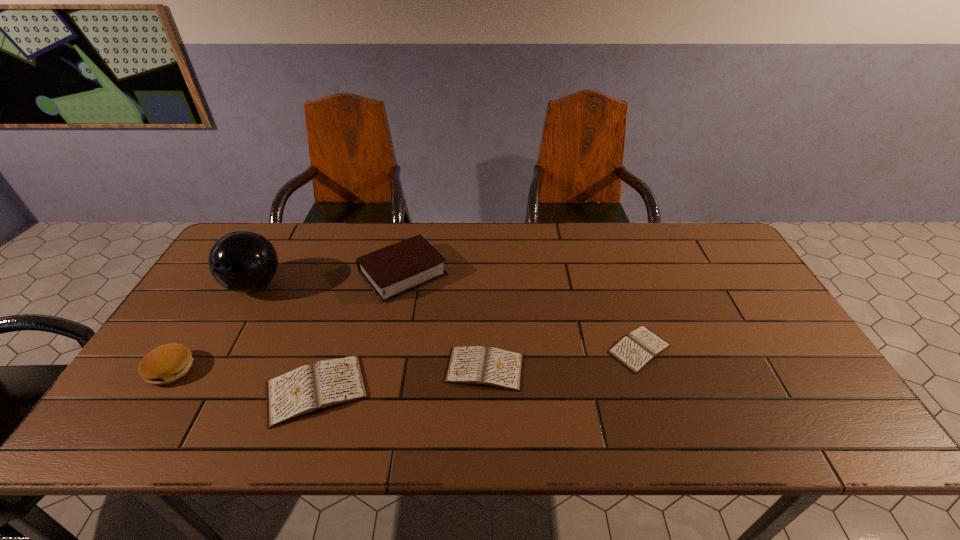
Find the location of `object that is positioned at the far left corner`. object that is positioned at the far left corner is located at coordinates (242, 261).

Where is `object present at the near left corner`? This screenshot has width=960, height=540. object present at the near left corner is located at coordinates (165, 364).

The image size is (960, 540). In the image, there is a desktop. In order to click on blank space at the far edge in this screenshot , I will do `click(373, 240)`.

What are the coordinates of `vacant point at the left edge` in the screenshot? It's located at (232, 329).

Locate an element on the screen. This screenshot has width=960, height=540. free space at the right edge is located at coordinates (760, 340).

In the image, there is a desktop. At what (x,y) coordinates should I click in order to perform the action: click on vacant space at the far left corner. Please return your answer as a coordinate pair (x, y). This screenshot has height=540, width=960. Looking at the image, I should click on (245, 226).

The height and width of the screenshot is (540, 960). What are the coordinates of `vacant space at the far right corner of the desktop` in the screenshot? It's located at (693, 254).

In order to click on free space that is in between the rightmost object and the Bible in this screenshot , I will do `click(521, 311)`.

At what (x,y) coordinates should I click in order to perform the action: click on empty space that is in between the second tallest diary and the shortest object. Please return your answer as a coordinate pair (x, y). Looking at the image, I should click on [x=563, y=359].

Find the location of `vacant area that lies between the Bible and the tallest object`. vacant area that lies between the Bible and the tallest object is located at coordinates (329, 279).